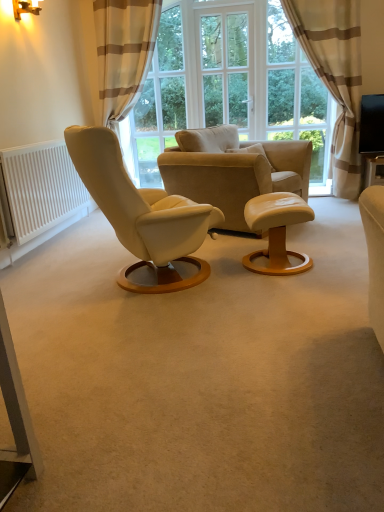
Identify the location of free space in front of beige striped curtain at upper right, the first curtain viewed from the right. This screenshot has height=512, width=384. (329, 211).